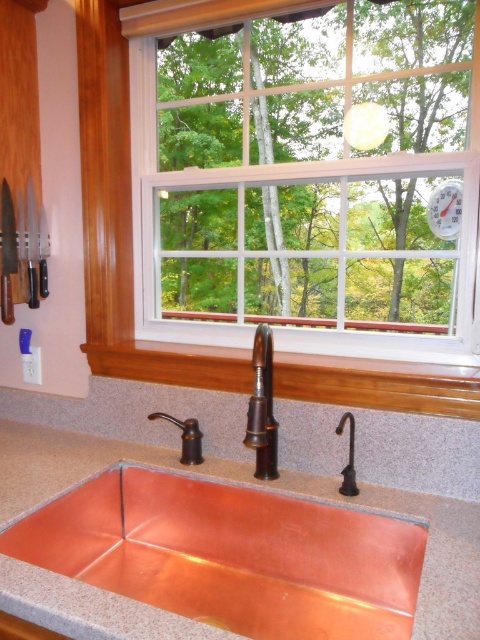
Question: Where is copper metallic sink at center located in relation to wooden window sill at center in the image?

Choices:
 (A) below
 (B) above

Answer: (A)

Question: Which object is closer to the camera taking this photo?

Choices:
 (A) copper metallic sink at center
 (B) metallic silver clock at upper right

Answer: (A)

Question: Which point is closer to the camera taking this photo?

Choices:
 (A) (263, 326)
 (B) (456, 180)

Answer: (A)

Question: From the image, what is the correct spatial relationship of copper metallic sink at center in relation to copper metallic faucet at center?

Choices:
 (A) left
 (B) right

Answer: (A)

Question: Is copper metallic faucet at center bigger than metallic silver clock at upper right?

Choices:
 (A) yes
 (B) no

Answer: (A)

Question: Which object is closer to the camera taking this photo?

Choices:
 (A) metallic silver clock at upper right
 (B) copper metallic faucet at center

Answer: (B)